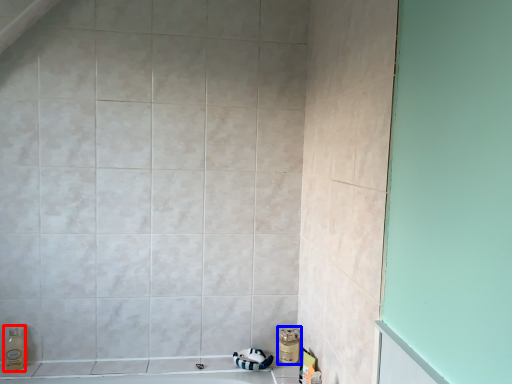
Question: Which object appears farthest to the camera in this image, soap dispenser (highlighted by a red box) or toiletry (highlighted by a blue box)?

Choices:
 (A) soap dispenser
 (B) toiletry

Answer: (B)